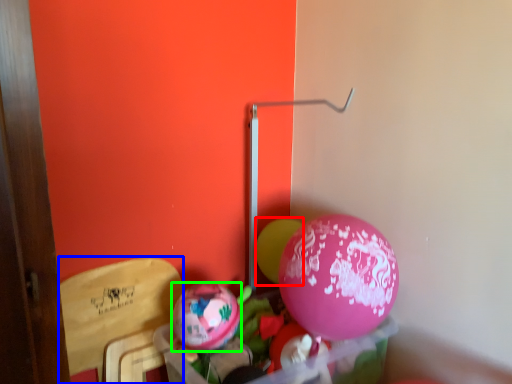
Question: Which object is the closest to the balloon (highlighted by a red box)? Choose among these: armchair (highlighted by a blue box) or balloon (highlighted by a green box).

Choices:
 (A) armchair
 (B) balloon

Answer: (B)